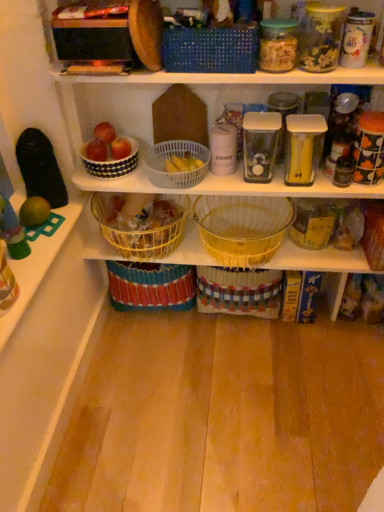
Identify the location of vacant space to the right of red matte apple at upper left, marked as the 2th apple in a right-to-left arrangement. (140, 166).